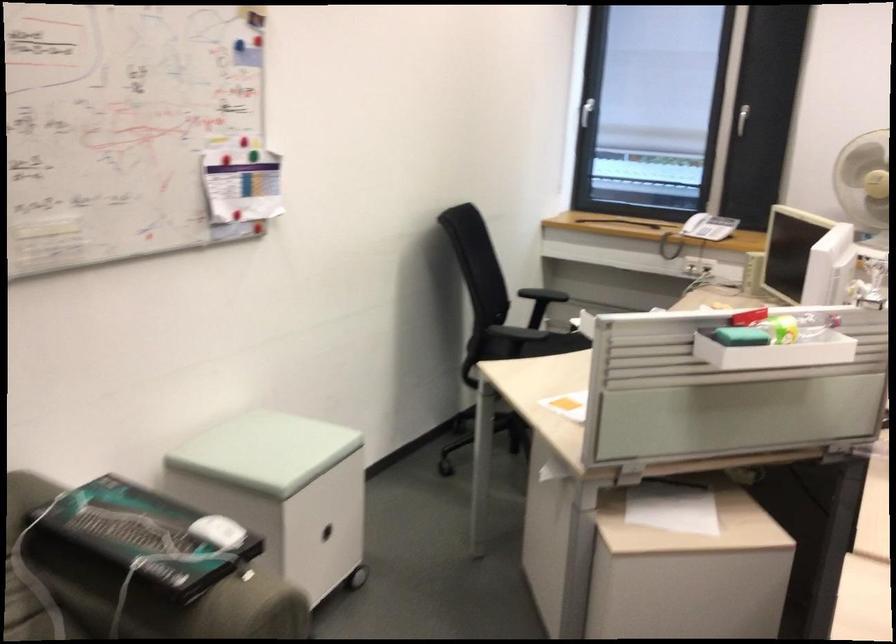
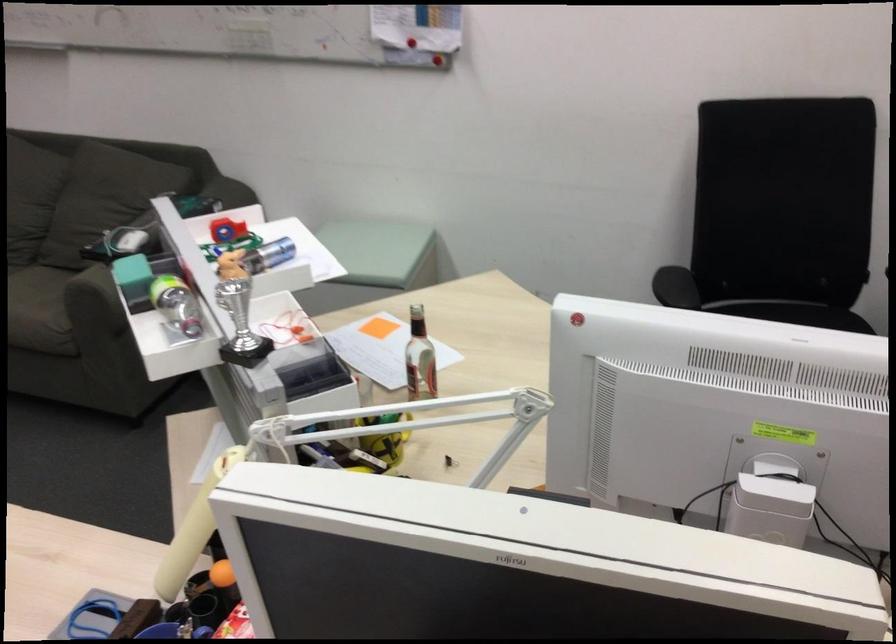
Locate, in the second image, the point that corresponds to the point at 718,343 in the first image.

(240, 324)